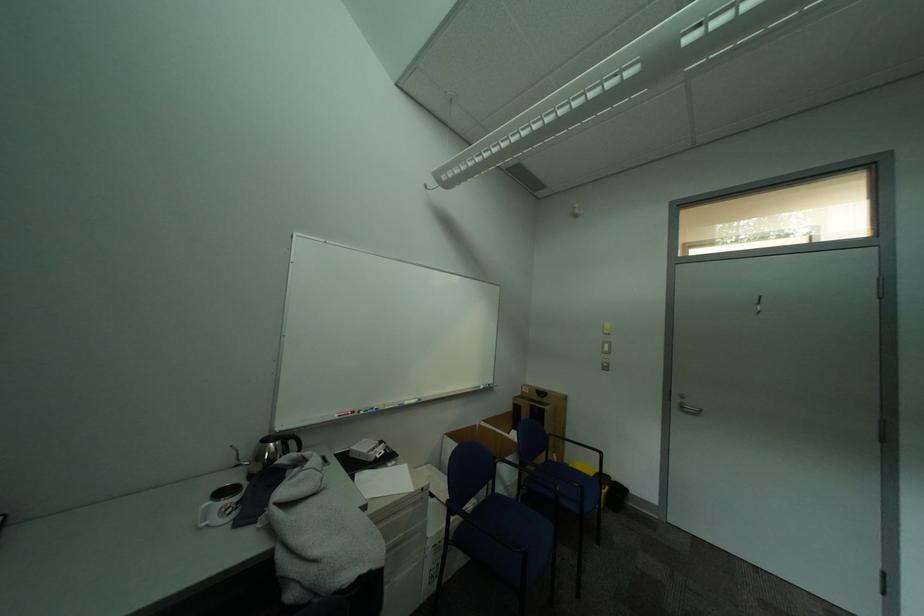
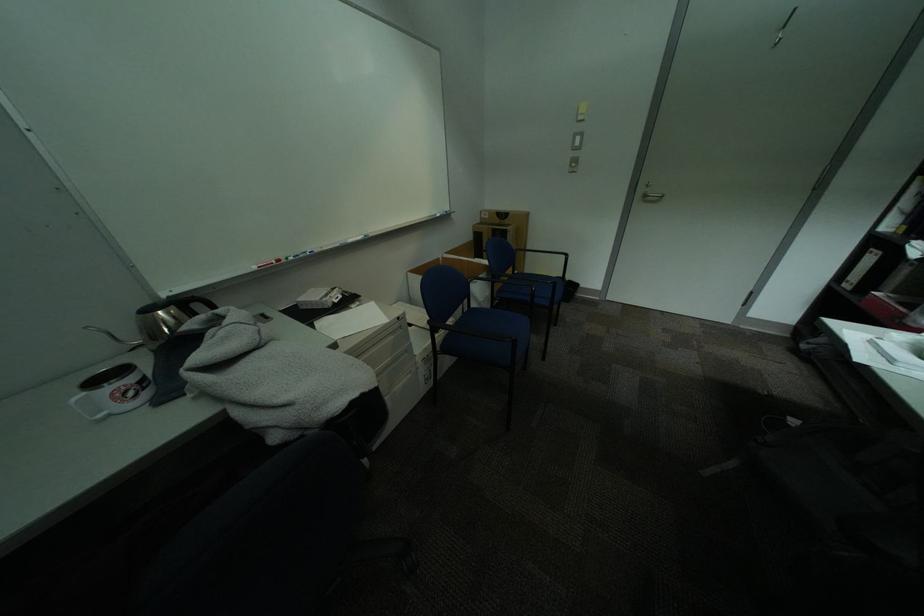
Question: The first image is from the beginning of the video and the second image is from the end. How did the camera likely rotate when shooting the video?

Choices:
 (A) Left
 (B) Right
 (C) Up
 (D) Down

Answer: (D)